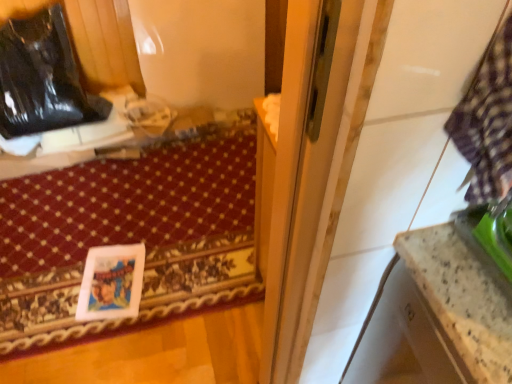
What do you see at coordinates (461, 299) in the screenshot? I see `granite countertop at right` at bounding box center [461, 299].

The image size is (512, 384). In order to click on granite countertop at right in this screenshot , I will do `click(461, 299)`.

In order to click on granite countertop at right in this screenshot , I will do `click(461, 299)`.